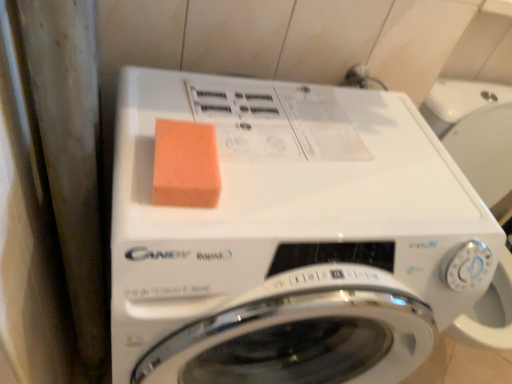
Image resolution: width=512 pixels, height=384 pixels. Find the location of `vacant area that lies to the right of orange sponge at upper center`. vacant area that lies to the right of orange sponge at upper center is located at coordinates (284, 187).